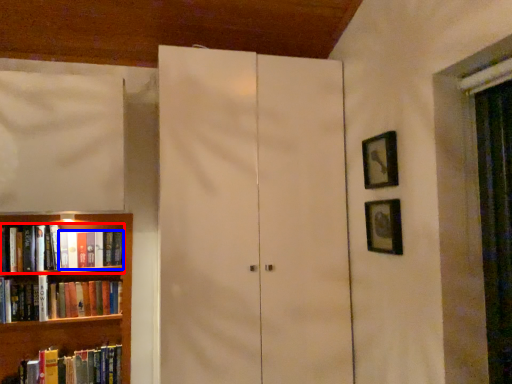
Question: Among these objects, which one is nearest to the camera, book (highlighted by a red box) or book (highlighted by a blue box)?

Choices:
 (A) book
 (B) book

Answer: (A)